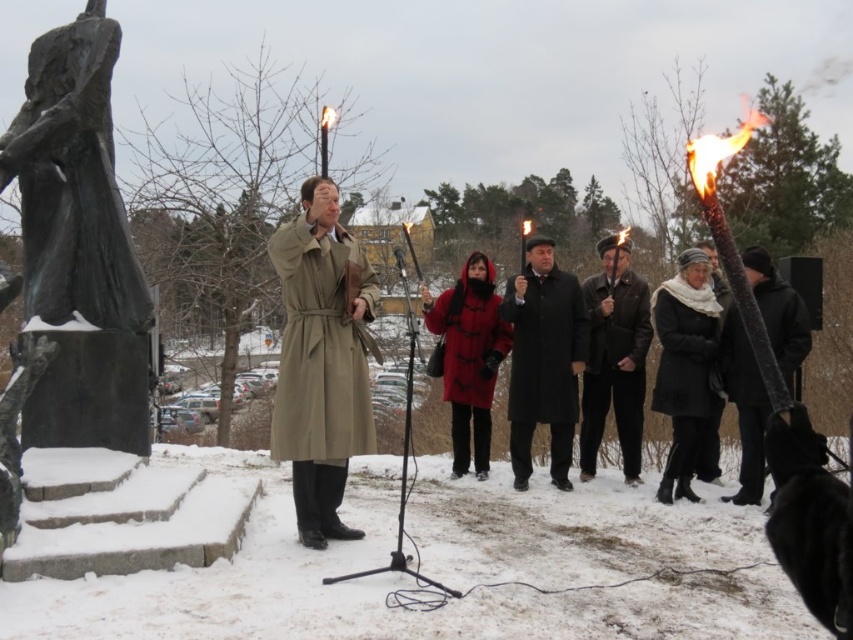
Looking at this image, you are organizing a winter event and need to place a 3D printed replica of the tan leather trench coat at center so it aligns with the bronze statue at left. Based on their widths, will the replica fit next to the statue without overlapping?

The bronze statue at left might be wider than the tan leather trench coat at center, so the replica could fit next to it without overlapping if positioned carefully.